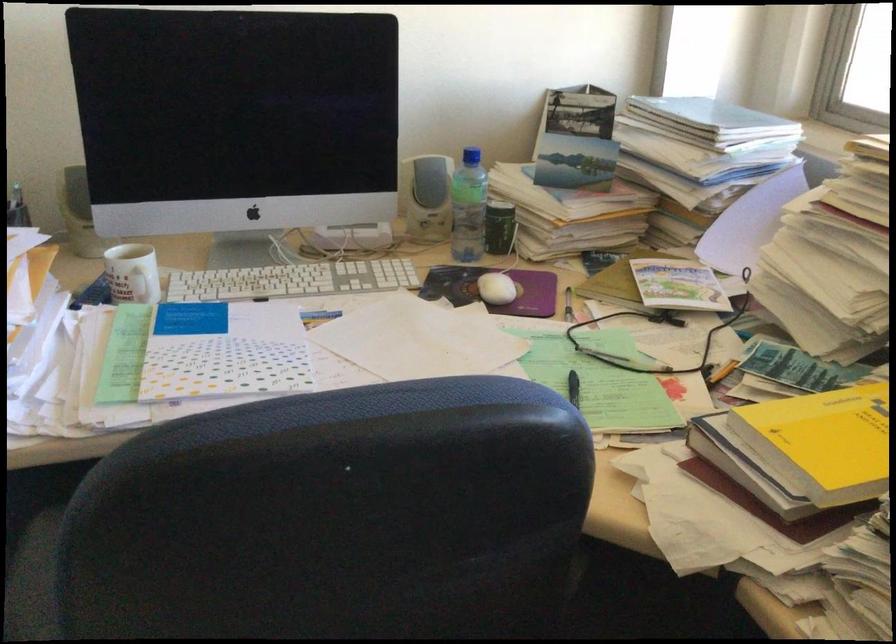
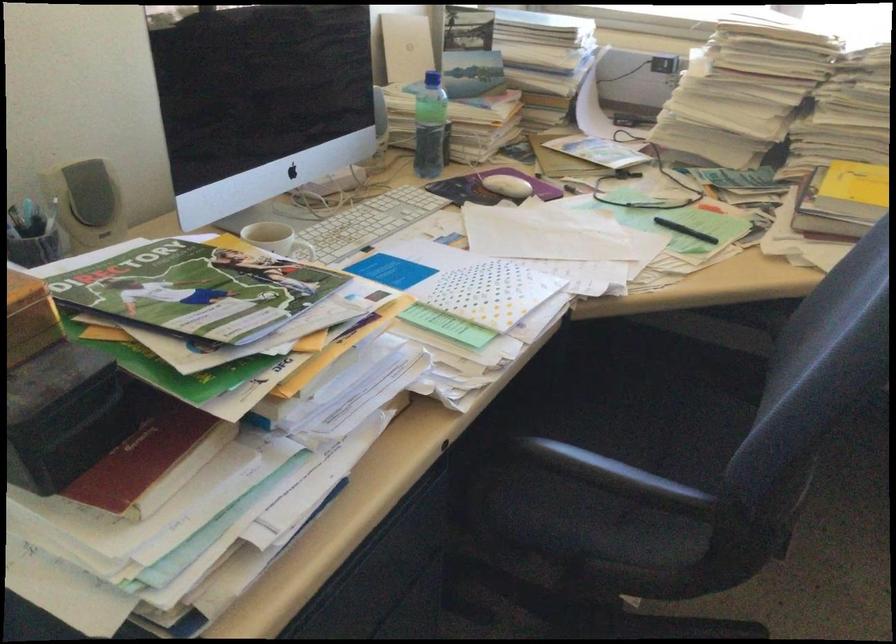
The point at (x=448, y=205) is marked in the first image. Where is the corresponding point in the second image?

(428, 126)